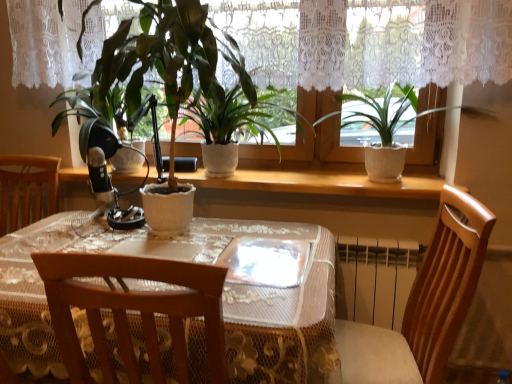
Question: From the image's perspective, is white textured pot at upper right, which appears as the 2th houseplant when viewed from the left, over white ceramic plant pot at center?

Choices:
 (A) yes
 (B) no

Answer: (A)

Question: Is white textured pot at upper right, the first houseplant in the right-to-left sequence, not within white ceramic plant pot at center?

Choices:
 (A) no
 (B) yes

Answer: (B)

Question: Is white ceramic plant pot at center located within white textured pot at upper right, which appears as the 2th houseplant when viewed from the left?

Choices:
 (A) no
 (B) yes

Answer: (A)

Question: Considering the relative sizes of white textured pot at upper right, which appears as the 2th houseplant when viewed from the left, and white ceramic plant pot at center in the image provided, is white textured pot at upper right, which appears as the 2th houseplant when viewed from the left, smaller than white ceramic plant pot at center?

Choices:
 (A) no
 (B) yes

Answer: (A)

Question: Does white textured pot at upper right, the first houseplant in the right-to-left sequence, turn towards white ceramic plant pot at center?

Choices:
 (A) no
 (B) yes

Answer: (A)

Question: Does point (249, 254) appear closer or farther from the camera than point (410, 317)?

Choices:
 (A) farther
 (B) closer

Answer: (B)

Question: From the image's perspective, relative to wooden chair at lower right, is transparent plastic plate at center above or below?

Choices:
 (A) above
 (B) below

Answer: (A)

Question: Considering the positions of transparent plastic plate at center and wooden chair at lower right in the image, is transparent plastic plate at center wider or thinner than wooden chair at lower right?

Choices:
 (A) thin
 (B) wide

Answer: (A)

Question: In terms of height, does transparent plastic plate at center look taller or shorter compared to wooden chair at lower right?

Choices:
 (A) short
 (B) tall

Answer: (A)

Question: Would you say transparent plastic plate at center is to the left or to the right of white ceramic plant pot at center in the picture?

Choices:
 (A) left
 (B) right

Answer: (B)

Question: Which is correct: transparent plastic plate at center is inside white ceramic plant pot at center, or outside of it?

Choices:
 (A) inside
 (B) outside

Answer: (B)

Question: In terms of size, does transparent plastic plate at center appear bigger or smaller than white ceramic plant pot at center?

Choices:
 (A) small
 (B) big

Answer: (A)

Question: From the image's perspective, is transparent plastic plate at center positioned above or below white ceramic plant pot at center?

Choices:
 (A) above
 (B) below

Answer: (B)

Question: Considering their positions, is transparent plastic plate at center located in front of or behind white ceramic pot at center, arranged as the first houseplant when viewed from the left?

Choices:
 (A) front
 (B) behind

Answer: (B)

Question: From the image's perspective, is transparent plastic plate at center above or below white ceramic pot at center, which is counted as the second houseplant, starting from the right?

Choices:
 (A) below
 (B) above

Answer: (A)